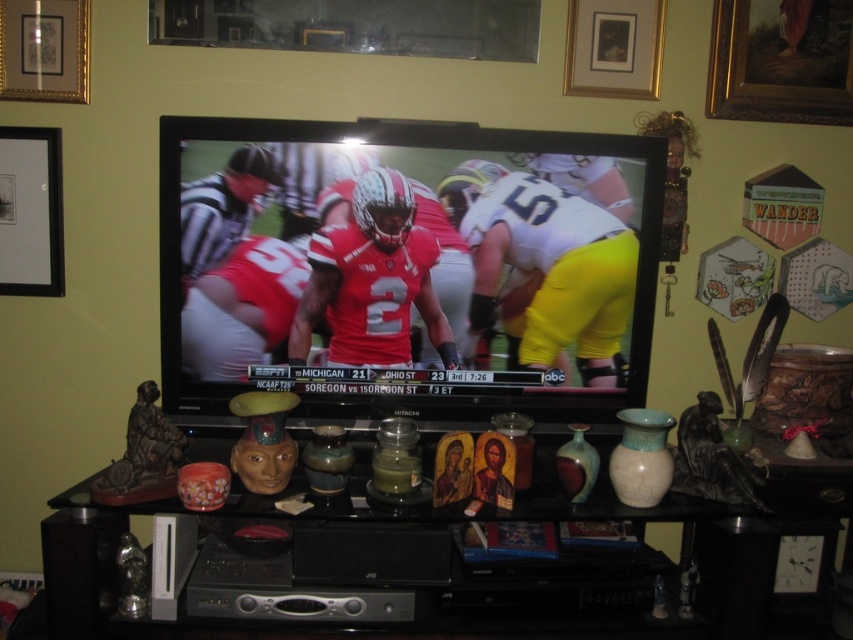
You are arranging flowers in the living room and want to place them in the matte ceramic vase at center so they are visible from the couch. Since the goldframed painting at upper right is behind the vase, will the flowers be obscured by the painting?

The matte ceramic vase at center is in front of the goldframed painting at upper right, so the flowers in the vase will not be obscured by the painting as they are positioned closer to the viewer.

You need to place a new decorative item on the entertainment center. The item is wider than the goldframed painting at upper right but narrower than the matte ceramic vase at center. Where on the entertainment center can you place it without overlapping existing items?

The new decorative item can be placed between the matte ceramic vase at center and the goldframed painting at upper right since it is wider than the goldframed painting at upper right but narrower than the matte ceramic vase at center.